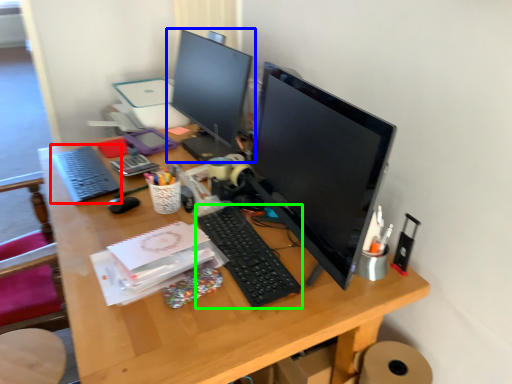
Question: Which is nearer to the computer keyboard (highlighted by a red box)? computer monitor (highlighted by a blue box) or computer keyboard (highlighted by a green box).

Choices:
 (A) computer monitor
 (B) computer keyboard

Answer: (A)